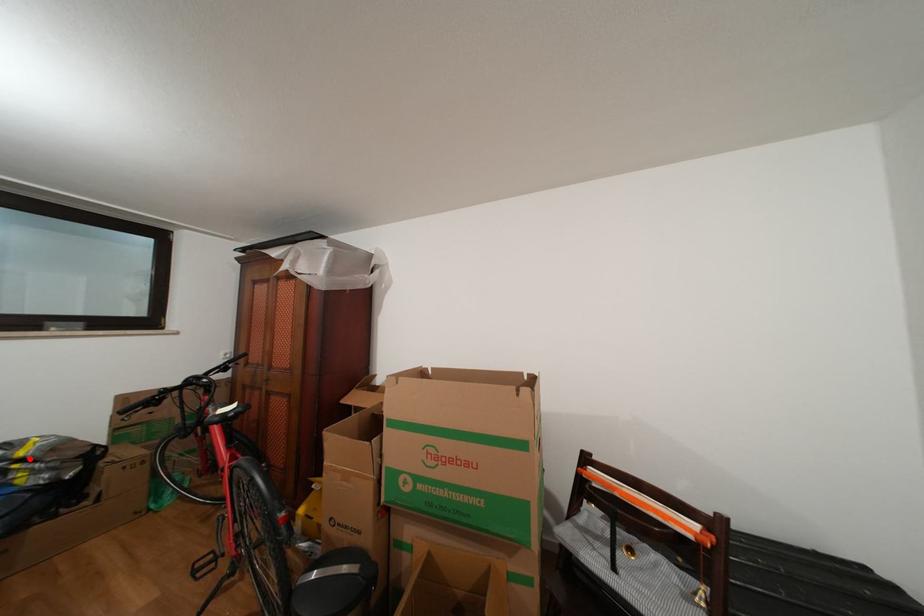
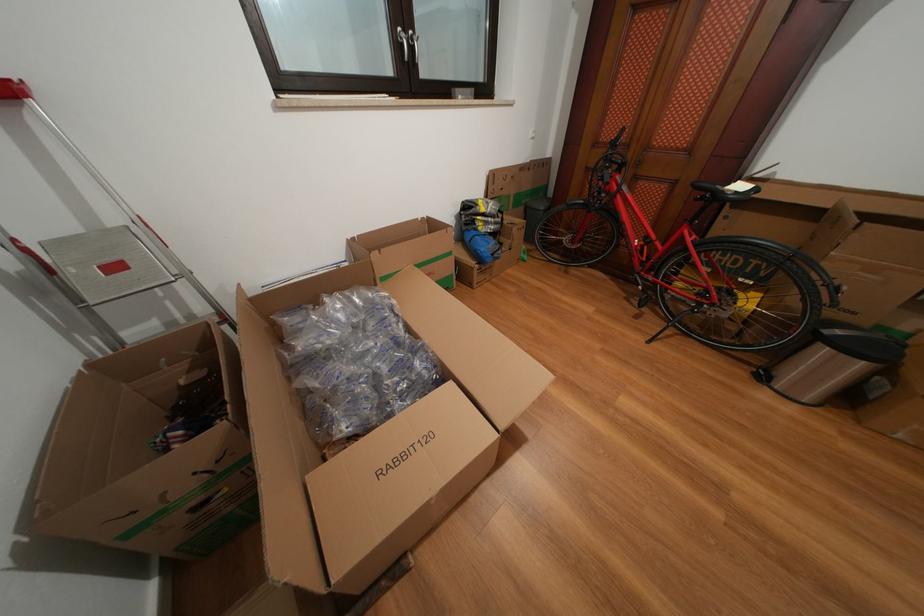
In the second image, find the point that corresponds to the highlighted location in the first image.

(491, 215)